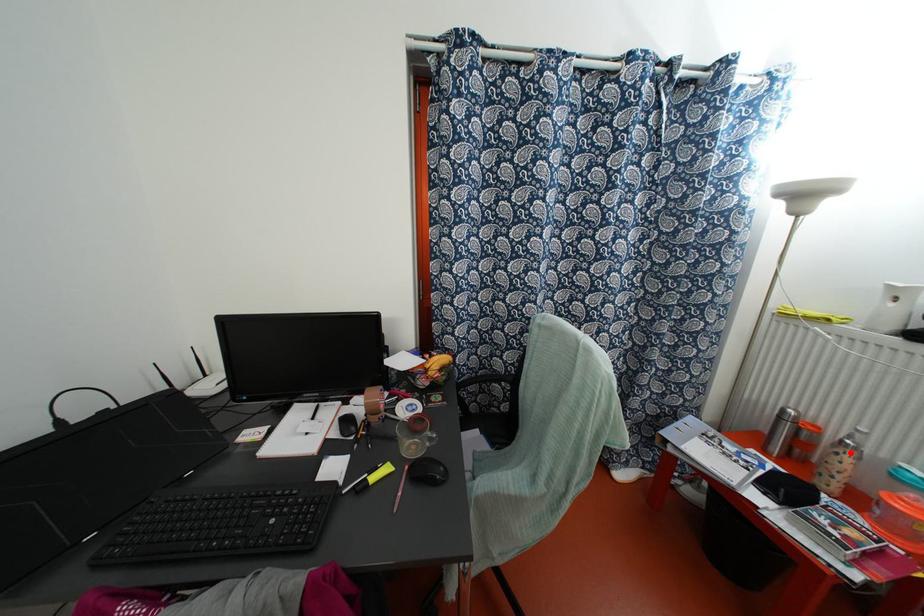
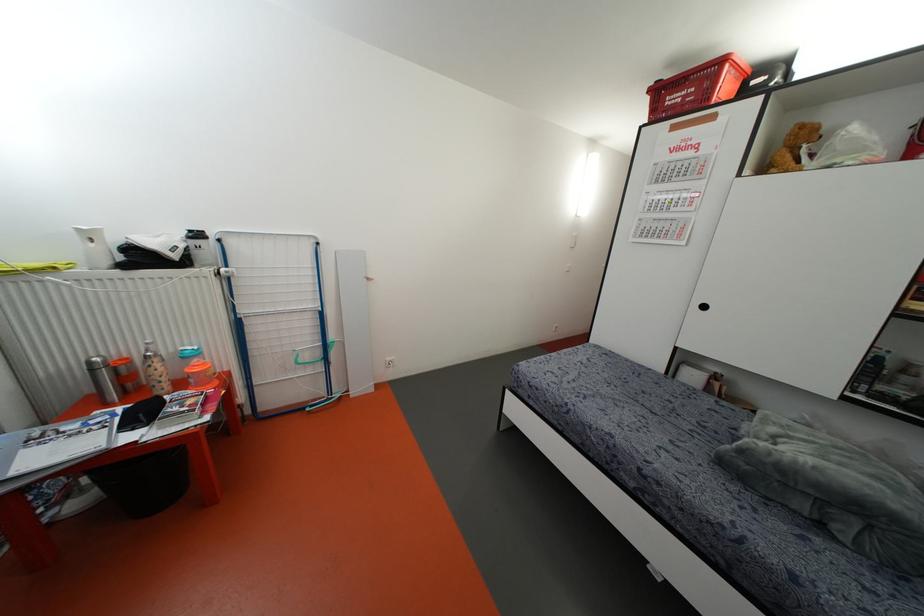
Question: I am providing you with two images of the same scene from different viewpoints. A red point is shown in image1. For the corresponding object point in image2, is it positioned nearer or farther from the camera?

Choices:
 (A) Nearer
 (B) Farther

Answer: (B)